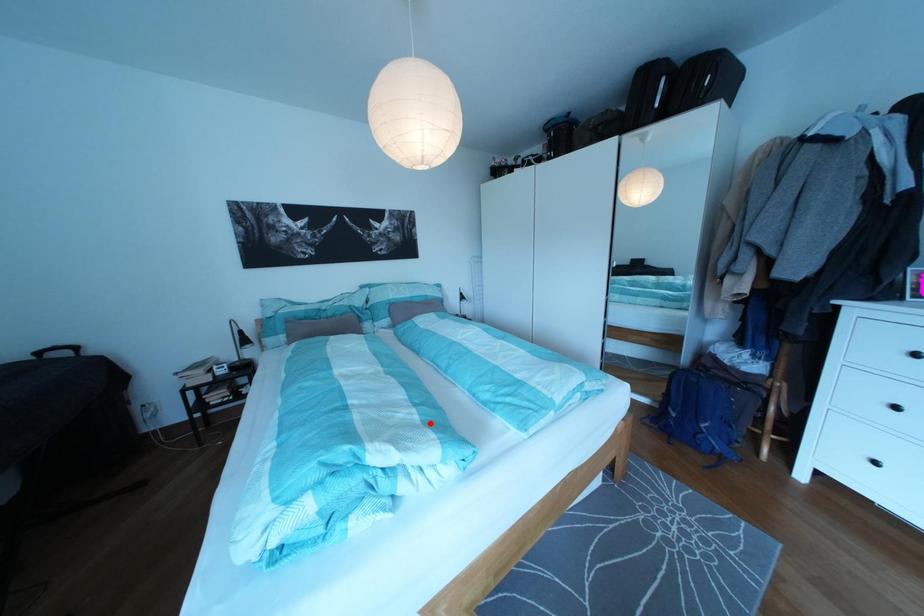
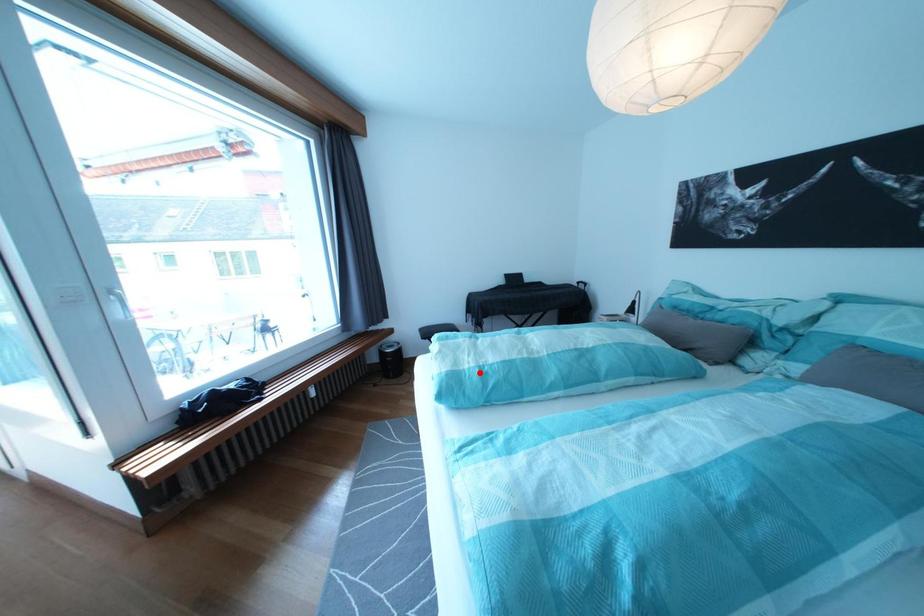
I am providing you with two images of the same scene from different viewpoints. A red point is marked on the first image and another point is marked on the second image. Is the red point in image1 aligned with the point shown in image2?

Yes